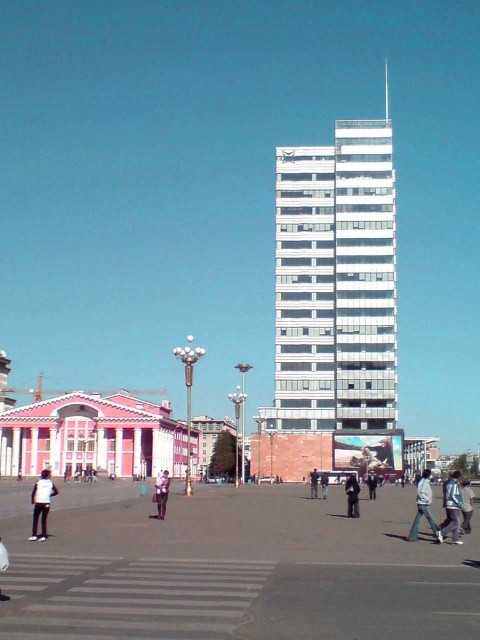
You are a pedestrian standing at the edge of the plaza and see the pink fabric bag at center and the denim jacket at center. Which item is positioned lower in the scene?

The pink fabric bag at center is positioned lower than the denim jacket at center.

You are standing in the pedestrian plaza and notice two points marked on the building in the background. The first point is at coordinates point (156, 513) and the second is at point (324, 474). Which point is closer to your current position?

Point (156, 513) is closer to the camera than point (324, 474), so the first point is closer to your current position.